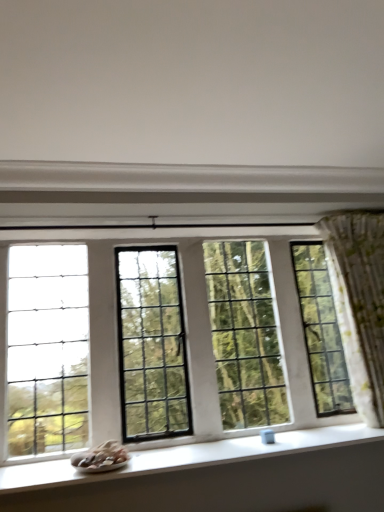
Question: Is green floral fabric curtain at right oriented towards white matte wall at upper center?

Choices:
 (A) yes
 (B) no

Answer: (B)

Question: Is white matte wall at upper center inside green floral fabric curtain at right?

Choices:
 (A) yes
 (B) no

Answer: (B)

Question: From a real-world perspective, is green floral fabric curtain at right physically below white matte wall at upper center?

Choices:
 (A) no
 (B) yes

Answer: (B)

Question: Can you confirm if green floral fabric curtain at right is positioned to the left of white matte wall at upper center?

Choices:
 (A) no
 (B) yes

Answer: (A)

Question: From the image's perspective, does green floral fabric curtain at right appear higher than white matte wall at upper center?

Choices:
 (A) yes
 (B) no

Answer: (B)

Question: Is green floral fabric curtain at right turned away from white matte wall at upper center?

Choices:
 (A) no
 (B) yes

Answer: (A)

Question: Considering the relative sizes of clear glass window at center and white matte wall at upper center in the image provided, is clear glass window at center shorter than white matte wall at upper center?

Choices:
 (A) yes
 (B) no

Answer: (B)

Question: Considering the relative sizes of clear glass window at center and white matte wall at upper center in the image provided, is clear glass window at center bigger than white matte wall at upper center?

Choices:
 (A) yes
 (B) no

Answer: (A)

Question: Considering the relative sizes of clear glass window at center and white matte wall at upper center in the image provided, is clear glass window at center thinner than white matte wall at upper center?

Choices:
 (A) no
 (B) yes

Answer: (B)

Question: From a real-world perspective, is clear glass window at center under white matte wall at upper center?

Choices:
 (A) no
 (B) yes

Answer: (B)

Question: From the image's perspective, is clear glass window at center above white matte wall at upper center?

Choices:
 (A) yes
 (B) no

Answer: (B)

Question: Does clear glass window at center turn towards white matte wall at upper center?

Choices:
 (A) no
 (B) yes

Answer: (B)

Question: Is white smooth window sill at lower center wider than green floral fabric curtain at right?

Choices:
 (A) yes
 (B) no

Answer: (A)